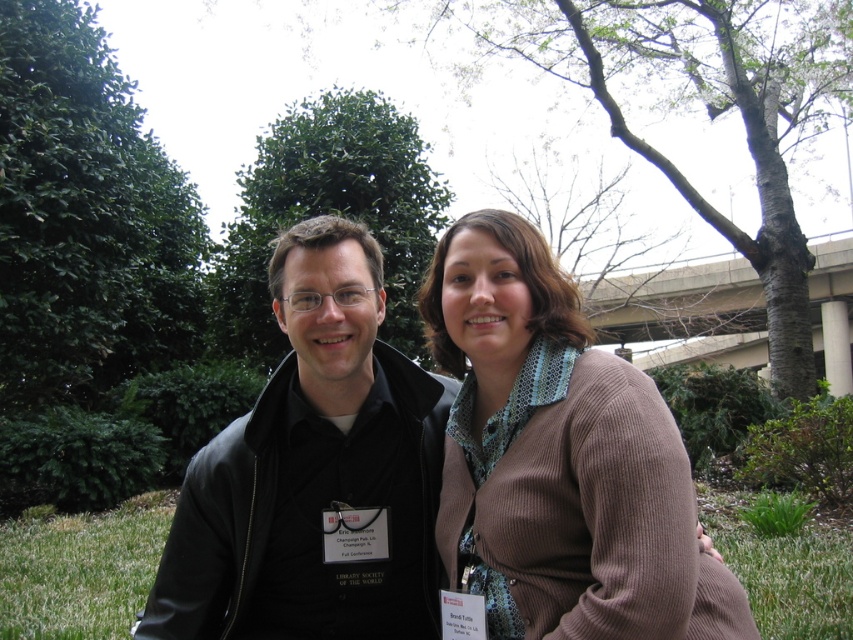
You are a photographer at a park event and need to capture both the black leather jacket at center and the green leafy tree at upper left in a single frame. Considering their sizes, which object should you focus on to ensure both are clearly visible?

The black leather jacket at center has a larger size compared to the green leafy tree at upper left. To ensure both are clearly visible, focus on the black leather jacket at center since it is larger and will be more prominent in the frame.

You are taking a photo of the two people at an event. The green leafy tree at upper left is in the background. To ensure the tree is not blocking the people, should you move the camera to the right or left?

The green leafy tree at upper left is located at point (85, 216), so moving the camera to the right would position it away from the tree, ensuring it doesn t block the people.

You are a photographer taking a picture of the two people in the scene. You notice the black leather jacket at center and the green leafy tree at upper left. Which object is taller in the image?

The black leather jacket at center is taller than the green leafy tree at upper left.